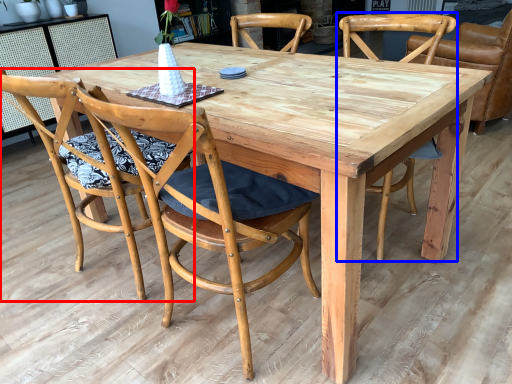
Question: Among these objects, which one is nearest to the camera, chair (highlighted by a red box) or chair (highlighted by a blue box)?

Choices:
 (A) chair
 (B) chair

Answer: (A)